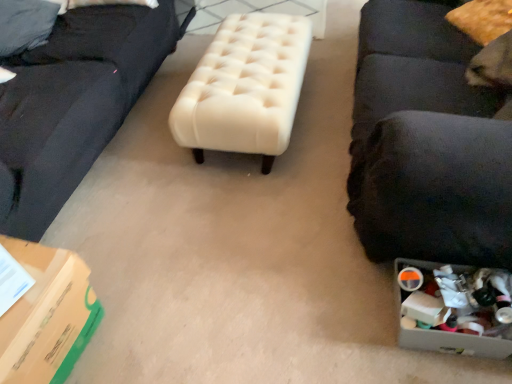
You are a GUI agent. You are given a task and a screenshot of the screen. Output one action in this format:
    pyautogui.click(x=<x>, y=<y>)
    Task: Click on the empty space that is ontop of green cardboard box at lower left
    The image size is (512, 384).
    Given the screenshot: What is the action you would take?
    pyautogui.click(x=27, y=285)